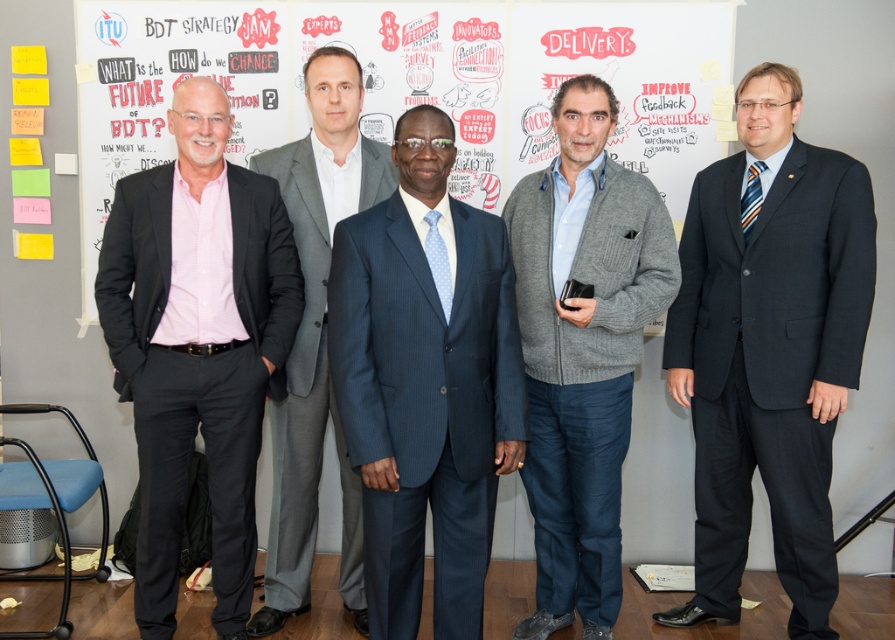
You are a photographer at the event and want to ensure all attendees in the photo are visible. Since the blue pinstripe suit at center and the gray suit at center are close to each other, which one is blocking the other?

The blue pinstripe suit at center is positioned under the gray suit at center, so the gray suit at center is blocking the blue pinstripe suit at center.

You are organizing a photoshoot and need to arrange the men in the image in a specific order. The client wants the man in the blue pinstripe suit at center to be placed to the left of the man in the gray suit at center. Is this possible based on their current positions?

→ The blue pinstripe suit at center is currently positioned on the right side of the gray suit at center. To meet the client request, the men would need to be rearranged so the blue pinstripe suit at center is moved to the left of the gray suit at center.